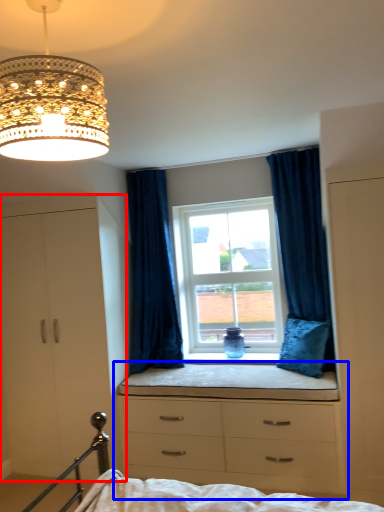
Question: Among these objects, which one is farthest to the camera, dresser (highlighted by a red box) or chest of drawers (highlighted by a blue box)?

Choices:
 (A) dresser
 (B) chest of drawers

Answer: (A)